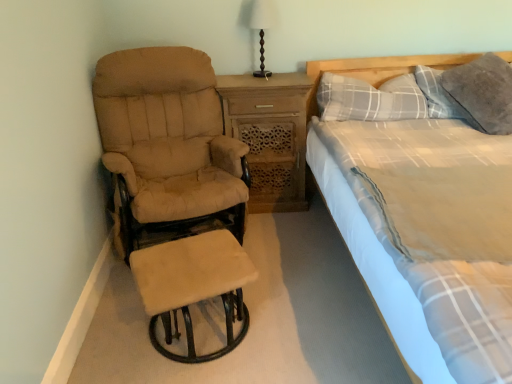
Locate an element on the screen. This screenshot has width=512, height=384. vacant area that is situated to the right of beige suede stool at lower left is located at coordinates (295, 325).